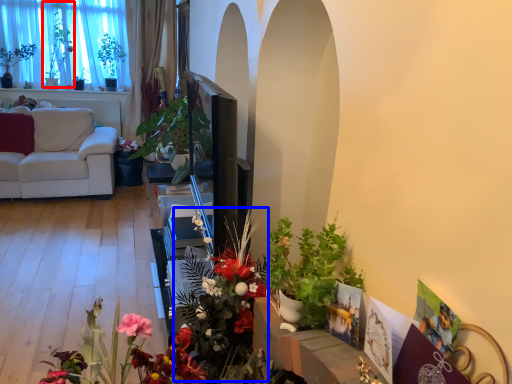
Question: Which point is closer to the camera, bouquet (highlighted by a red box) or floral arrangement (highlighted by a blue box)?

Choices:
 (A) bouquet
 (B) floral arrangement

Answer: (B)